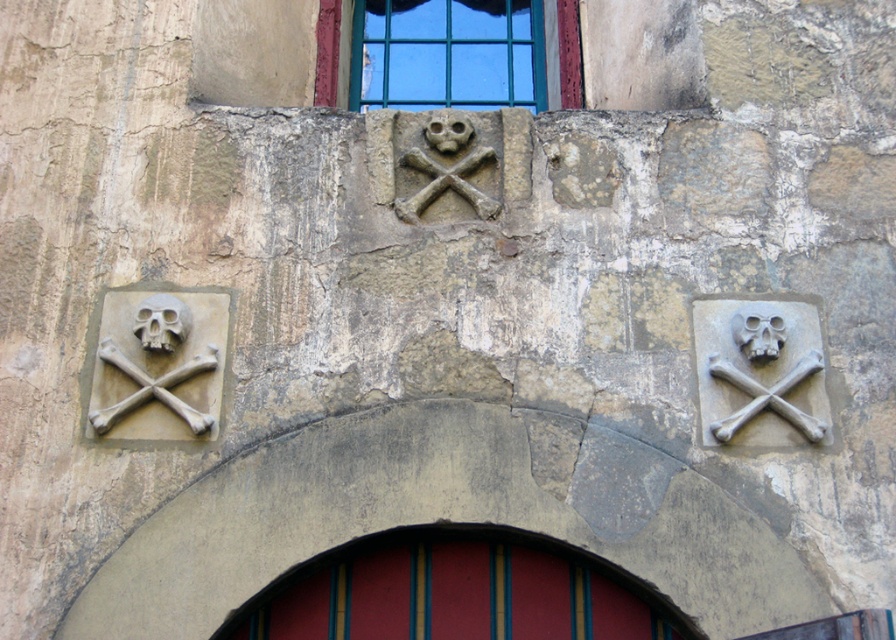
Based on the photo, you are an archaeologist examining an old stone wall with three identical symbols. You notice a specific point marked at coordinates (158, 365). Which symbol is this point located on?

The point at (158, 365) is located on the gray stone skull and crossbones at left.

You are an archaeologist examining the old stone building. You notice two symbols, the gray stone skull and crossbones at upper right and the stone skull and crossbones at center. Which one appears nearer to you?

The gray stone skull and crossbones at upper right is closer to the viewer than the stone skull and crossbones at center, so it appears nearer.

You are an architect examining the old stone building. You need to locate the gray stone skull and crossbones at upper right. Where exactly is it positioned on the wall?

The gray stone skull and crossbones at upper right is positioned at point (759, 372) on the wall.